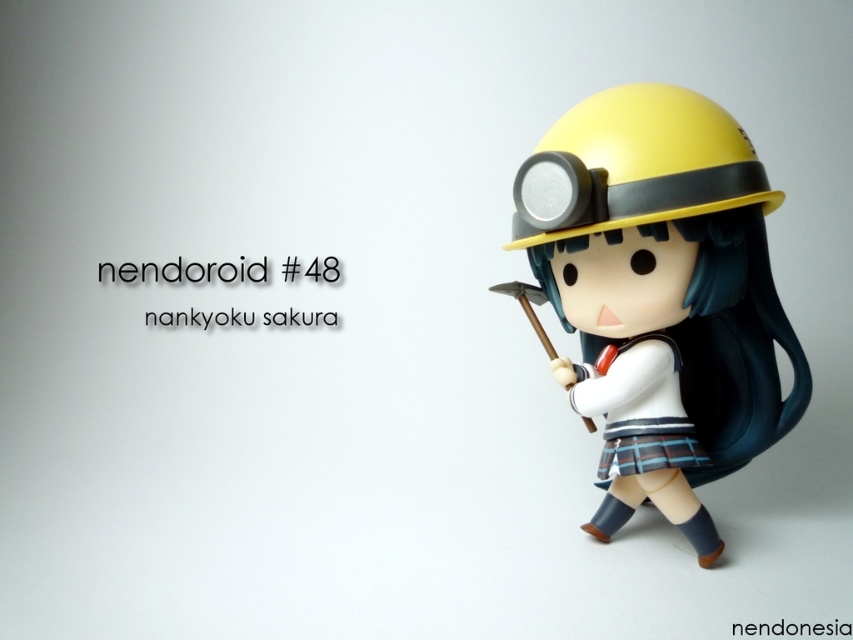
Does matte yellow helmet at upper right appear over yellow matte helmet at upper center?

No, matte yellow helmet at upper right is not above yellow matte helmet at upper center.

What do you see at coordinates (660, 294) in the screenshot? I see `matte yellow helmet at upper right` at bounding box center [660, 294].

Does point (624, 253) come closer to viewer compared to point (569, 212)?

No, it is not.

Locate an element on the screen. matte yellow helmet at upper right is located at coordinates [x=660, y=294].